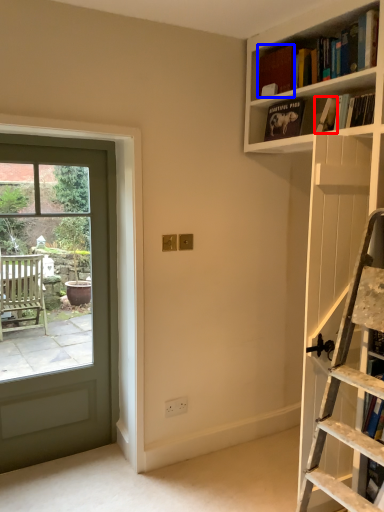
Question: Among these objects, which one is farthest to the camera, book (highlighted by a red box) or book (highlighted by a blue box)?

Choices:
 (A) book
 (B) book

Answer: (B)